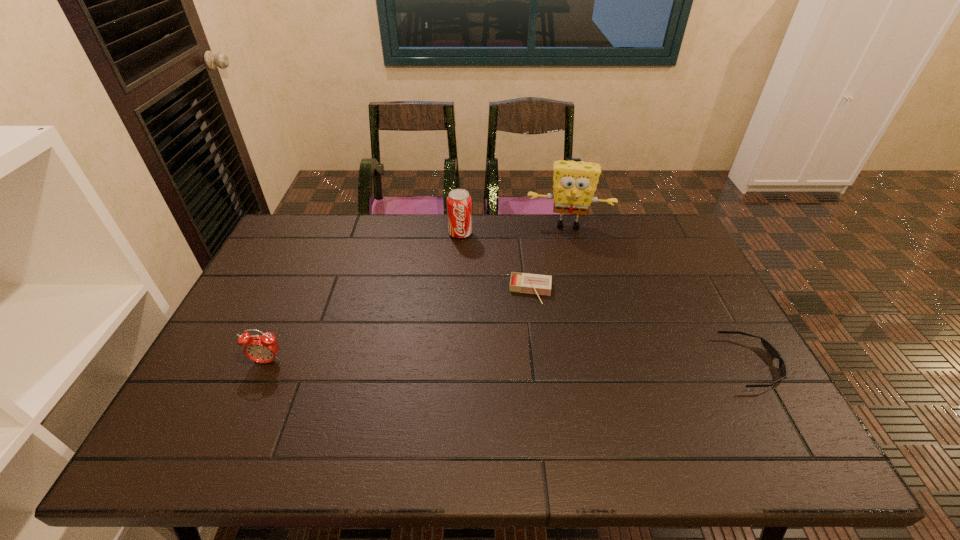
Locate an element on the screen. This screenshot has height=540, width=960. free space on the desktop that is between the third shortest object and the sunglasses and is positioned on the logo side of the second object from left to right is located at coordinates [x=463, y=362].

Locate an element on the screen. vacant space on the desktop that is between the leftmost object and the sunglasses and is positioned on the face of the sponge is located at coordinates (567, 362).

This screenshot has width=960, height=540. What are the coordinates of `vacant spot on the desktop that is between the alarm clock and the sunglasses and is positioned on the striking surface of the matchbox` in the screenshot? It's located at (524, 362).